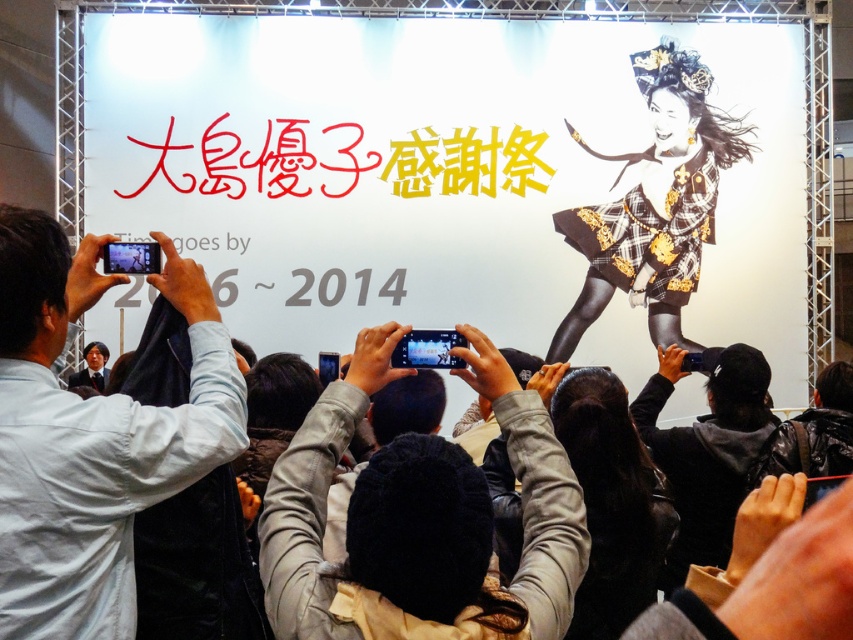
Can you confirm if matte black dress at upper right is positioned to the left of white shirt at left?

No, matte black dress at upper right is not to the left of white shirt at left.

Who is more distant from viewer, (x=552, y=282) or (x=196, y=428)?

The point (x=552, y=282) is behind.

You are a GUI agent. You are given a task and a screenshot of the screen. Output one action in this format:
    pyautogui.click(x=<x>, y=<y>)
    Task: Click on the matte black dress at upper right
    
    Given the screenshot: What is the action you would take?
    433,170

Can you confirm if leather jacket at center is bigger than black leather jacket at lower right?

No, leather jacket at center is not bigger than black leather jacket at lower right.

Who is more distant from viewer, [358,579] or [728,538]?

Positioned behind is point [728,538].

Where is `leather jacket at center`? Image resolution: width=853 pixels, height=640 pixels. leather jacket at center is located at coordinates (421, 518).

Is leather jacket at center positioned before white shirt at left?

Yes, leather jacket at center is in front of white shirt at left.

Can you confirm if leather jacket at center is positioned to the right of white shirt at left?

Correct, you'll find leather jacket at center to the right of white shirt at left.

This screenshot has height=640, width=853. Find the location of `leather jacket at center`. leather jacket at center is located at coordinates point(421,518).